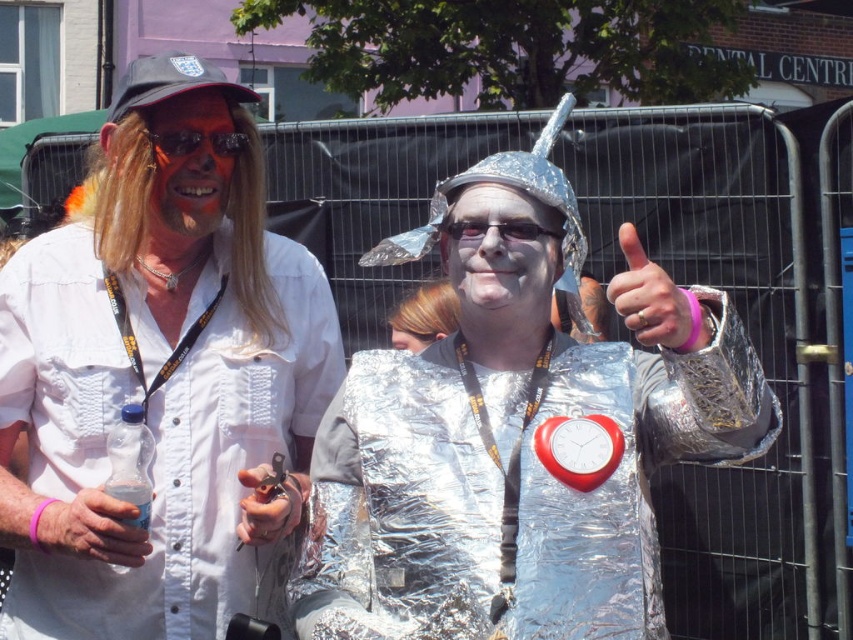
You are at a festival and want to grab the matte plastic bottle at lower left to drink water. However, the silver foil costume at center is blocking your path. Can you reach the bottle without moving the costume?

The matte plastic bottle at lower left is positioned under the silver foil costume at center, so you can reach it without moving the costume by bending down or reaching underneath.

You are a photographer at a festival trying to capture a photo of both the matte plastic bottle at lower left and the silver foil costume at center in the same frame. Your camera has a maximum focus range of 3 meters. Will you be able to include both objects in the photo?

The matte plastic bottle at lower left and the silver foil costume at center are 3.72 meters apart from each other. Since the distance exceeds the camera maximum focus range of 3 meters, you won

You are planning to take a photo of the matte white shirt at center and the matte plastic bottle at lower left. To ensure both are fully visible in the frame, should you adjust the camera to focus more on the foreground or background?

You should focus on the foreground because the matte plastic bottle at lower left is behind the matte white shirt at center, so adjusting focus to the foreground will keep both in focus.